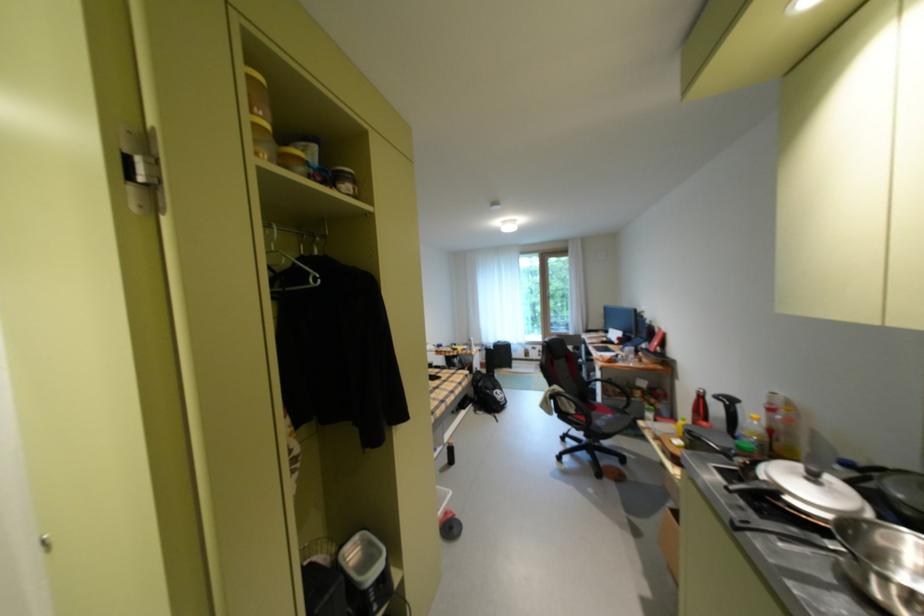
Which object does [292,160] point to?

This point indicates the yellow cylindrical container.